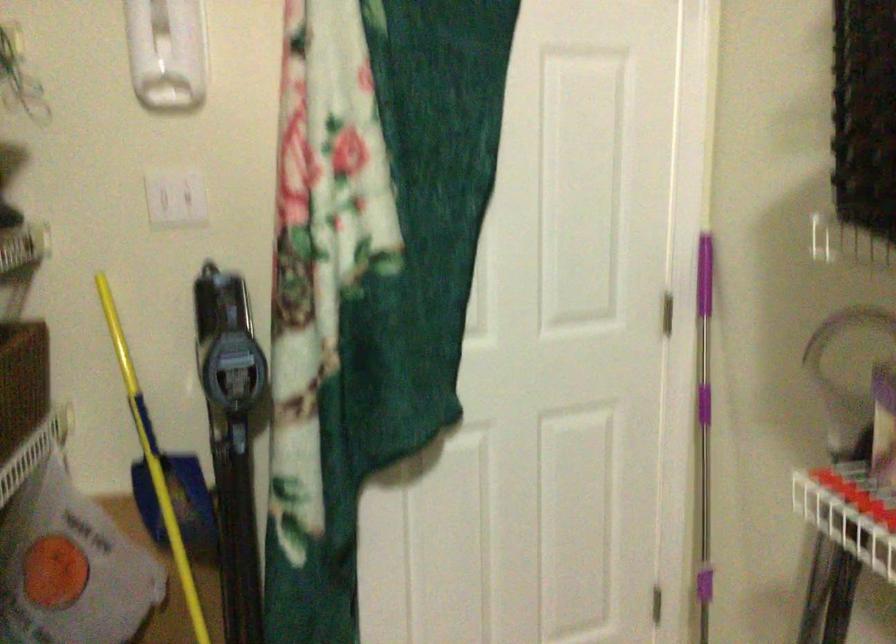
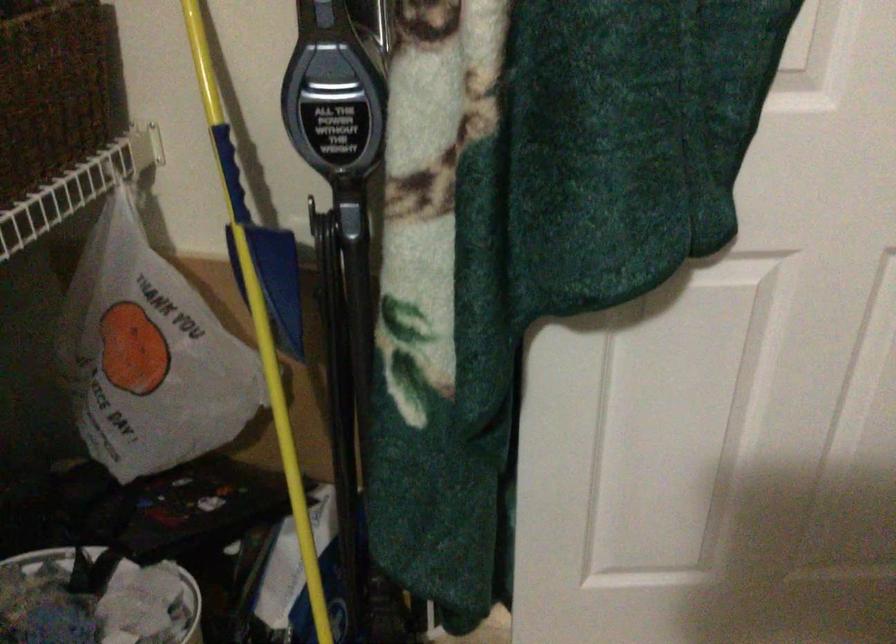
In the second image, find the point that corresponds to point 237,361 in the first image.

(332, 93)